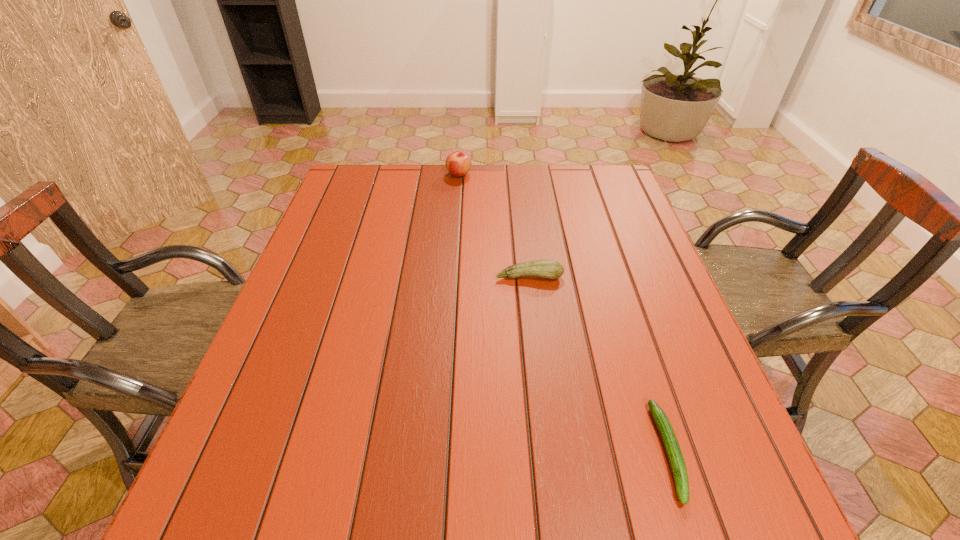
Where is `object positioned at the right edge`? This screenshot has width=960, height=540. object positioned at the right edge is located at coordinates (674, 454).

This screenshot has height=540, width=960. I want to click on object at the near right corner, so pyautogui.click(x=674, y=454).

Identify the location of free space at the far edge of the desktop. Image resolution: width=960 pixels, height=540 pixels. click(540, 194).

In order to click on vacant space at the near edge of the desktop in this screenshot , I will do `click(323, 526)`.

You are a GUI agent. You are given a task and a screenshot of the screen. Output one action in this format:
    pyautogui.click(x=<x>, y=<y>)
    Task: Click on the vacant area at the left edge of the desktop
    This screenshot has height=540, width=960.
    Given the screenshot: What is the action you would take?
    pyautogui.click(x=372, y=207)

Identify the location of vacant region at the right edge of the desktop. (666, 300).

Find the location of a particular element. The height and width of the screenshot is (540, 960). free location at the far left corner of the desktop is located at coordinates (330, 204).

This screenshot has width=960, height=540. I want to click on free space at the far right corner of the desktop, so click(x=578, y=204).

In order to click on free spot between the second farthest object and the right zucchini in this screenshot , I will do `click(599, 364)`.

In order to click on vacant area between the right zucchini and the left zucchini in this screenshot , I will do pyautogui.click(x=599, y=364).